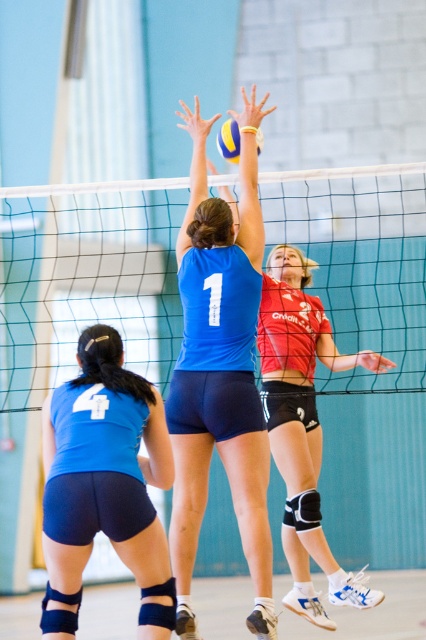
Question: Does blue matte/vinyl shorts at center have a greater width compared to matte blue shorts at lower left?

Choices:
 (A) no
 (B) yes

Answer: (A)

Question: Which point appears closest to the camera in this image?

Choices:
 (A) (215, 138)
 (B) (36, 241)
 (C) (247, 429)

Answer: (C)

Question: Estimate the real-world distances between objects in this image. Which object is farther from the red jersey at upper center?

Choices:
 (A) white mesh net at center
 (B) blue matte/vinyl shorts at center

Answer: (A)

Question: Is white mesh net at center positioned before yellow matte volleyball at center?

Choices:
 (A) no
 (B) yes

Answer: (A)

Question: Which of the following is the farthest from the observer?

Choices:
 (A) red jersey at upper center
 (B) matte blue shorts at lower left
 (C) blue matte/vinyl shorts at center
 (D) white mesh net at center

Answer: (D)

Question: Can you confirm if white mesh net at center is positioned to the right of blue matte/vinyl shorts at center?

Choices:
 (A) no
 (B) yes

Answer: (B)